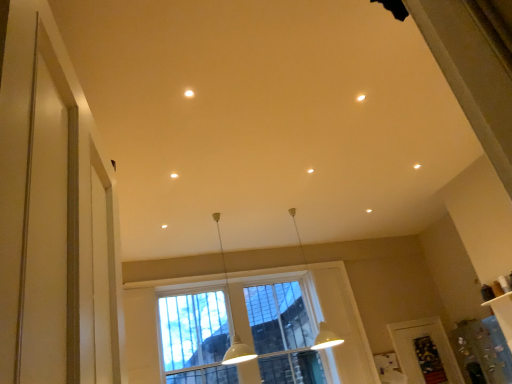
Question: Is matte white light fixture at upper center at the right side of clear glass window at center?

Choices:
 (A) yes
 (B) no

Answer: (B)

Question: From a real-world perspective, is matte white light fixture at upper center physically above clear glass window at center?

Choices:
 (A) yes
 (B) no

Answer: (A)

Question: From a real-world perspective, is matte white light fixture at upper center beneath clear glass window at center?

Choices:
 (A) yes
 (B) no

Answer: (B)

Question: Is the depth of matte white light fixture at upper center greater than that of clear glass window at center?

Choices:
 (A) yes
 (B) no

Answer: (B)

Question: Is matte white light fixture at upper center facing towards clear glass window at center?

Choices:
 (A) yes
 (B) no

Answer: (B)

Question: Considering the positions of white matte pendant light at center, which is the second lamp in left-to-right order, and white glossy pendant light at center, marked as the 2th lamp in a right-to-left arrangement, in the image, is white matte pendant light at center, which is the second lamp in left-to-right order, wider or thinner than white glossy pendant light at center, marked as the 2th lamp in a right-to-left arrangement,?

Choices:
 (A) wide
 (B) thin

Answer: (A)

Question: Looking at the image, does white matte pendant light at center, which is the second lamp in left-to-right order, seem bigger or smaller compared to white glossy pendant light at center, marked as the 2th lamp in a right-to-left arrangement?

Choices:
 (A) big
 (B) small

Answer: (A)

Question: Considering the relative positions of white matte pendant light at center, which is the second lamp in left-to-right order, and white glossy pendant light at center, marked as the 2th lamp in a right-to-left arrangement, in the image provided, is white matte pendant light at center, which is the second lamp in left-to-right order, to the left or to the right of white glossy pendant light at center, marked as the 2th lamp in a right-to-left arrangement,?

Choices:
 (A) right
 (B) left

Answer: (A)

Question: Is white matte pendant light at center, which is the second lamp in left-to-right order, situated inside white glossy pendant light at center, placed as the first lamp when sorted from left to right, or outside?

Choices:
 (A) outside
 (B) inside

Answer: (A)

Question: Choose the correct answer: Is matte white light fixture at upper center inside white glossy pendant light at center, marked as the 2th lamp in a right-to-left arrangement, or outside it?

Choices:
 (A) outside
 (B) inside

Answer: (A)

Question: From the image's perspective, relative to white glossy pendant light at center, marked as the 2th lamp in a right-to-left arrangement, is matte white light fixture at upper center above or below?

Choices:
 (A) below
 (B) above

Answer: (B)

Question: From their relative heights in the image, would you say matte white light fixture at upper center is taller or shorter than white glossy pendant light at center, placed as the first lamp when sorted from left to right?

Choices:
 (A) tall
 (B) short

Answer: (B)

Question: In terms of size, does matte white light fixture at upper center appear bigger or smaller than white glossy pendant light at center, marked as the 2th lamp in a right-to-left arrangement?

Choices:
 (A) big
 (B) small

Answer: (B)

Question: Is white matte pendant light at center, which is the second lamp in left-to-right order, wider or thinner than clear plastic screen door at lower right?

Choices:
 (A) wide
 (B) thin

Answer: (A)

Question: From a real-world perspective, is white matte pendant light at center, marked as the first lamp in a right-to-left arrangement, positioned above or below clear plastic screen door at lower right?

Choices:
 (A) above
 (B) below

Answer: (A)